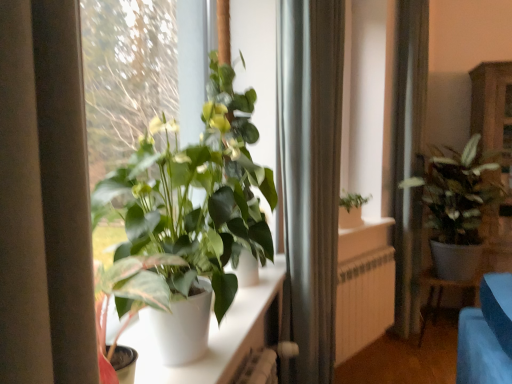
This screenshot has width=512, height=384. In order to click on vacant space underneath white matte radiator at center (from a real-world perspective) in this screenshot , I will do `click(365, 364)`.